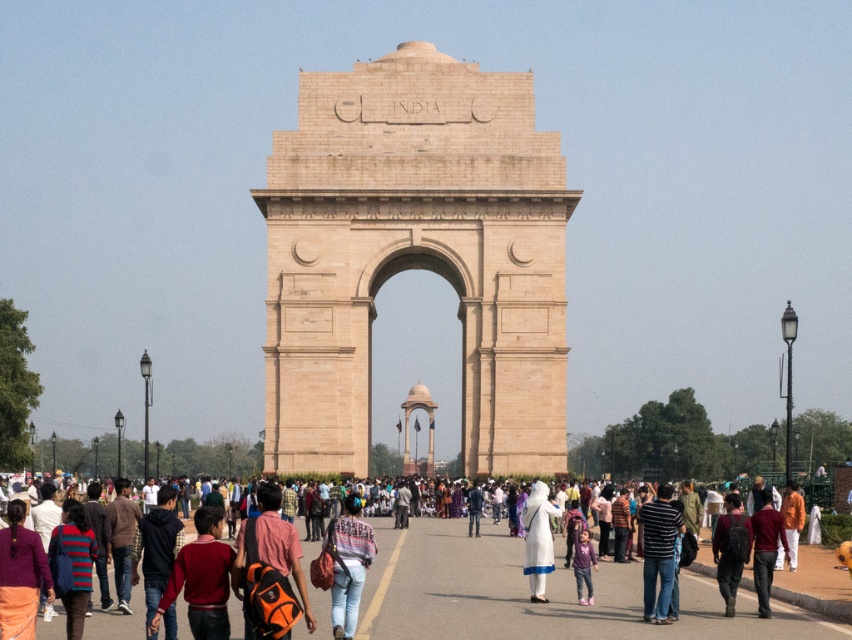
Question: Is multicolored clothing at center closer to camera compared to denim jeans at center?

Choices:
 (A) no
 (B) yes

Answer: (A)

Question: Among these objects, which one is farthest from the camera?

Choices:
 (A) beige stone arch at center
 (B) white fabric dress at center
 (C) dark brown leather backpack at center
 (D) denim jeans at center

Answer: (A)

Question: Among these objects, which one is nearest to the camera?

Choices:
 (A) multicolored clothing at center
 (B) dark brown leather backpack at center
 (C) beige stone arch at center
 (D) denim jeans at center

Answer: (D)

Question: In this image, where is beige stone arch at center located relative to dark brown leather backpack at center?

Choices:
 (A) left
 (B) right

Answer: (A)

Question: Among these points, which one is nearest to the camera?

Choices:
 (A) (548, 518)
 (B) (321, 253)
 (C) (737, 556)

Answer: (C)

Question: Is multicolored clothing at center to the right of white fabric dress at center from the viewer's perspective?

Choices:
 (A) no
 (B) yes

Answer: (A)